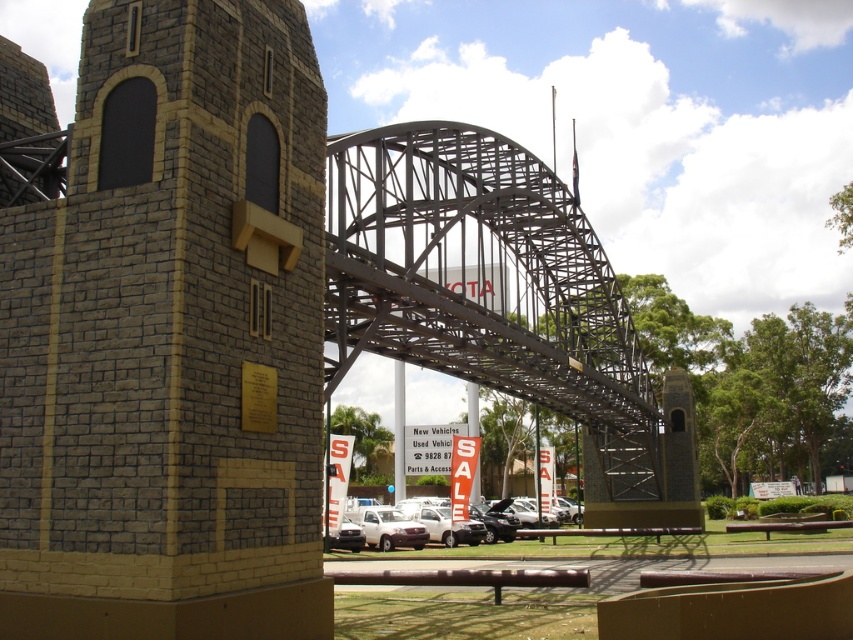
You are standing at the base of the brick textured tower at center. Looking towards the parking lot, where would you see the signboard that says New Vehicles?

The signboard that says New Vehicles is partially obscuring the brick textured tower at center, so it would be located near the columns supporting the archway.

You are driving a white matte truck at center and want to pass under the metallic gray bridge at center. Based on the scene description, can the truck safely pass under the bridge without hitting it?

The metallic gray bridge at center is larger in size compared to the white matte truck at center, so it is likely that the truck can pass safely under the bridge as the bridge has sufficient clearance.